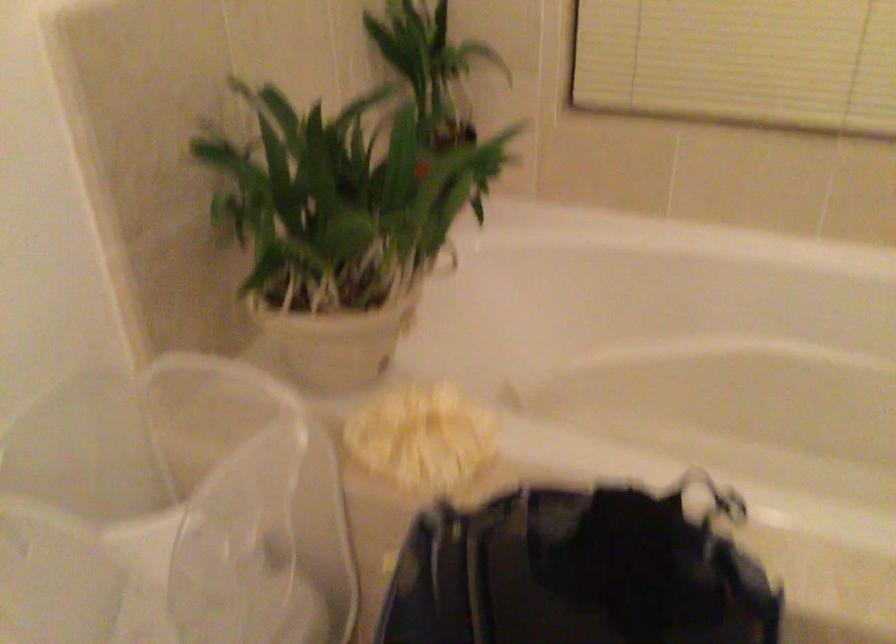
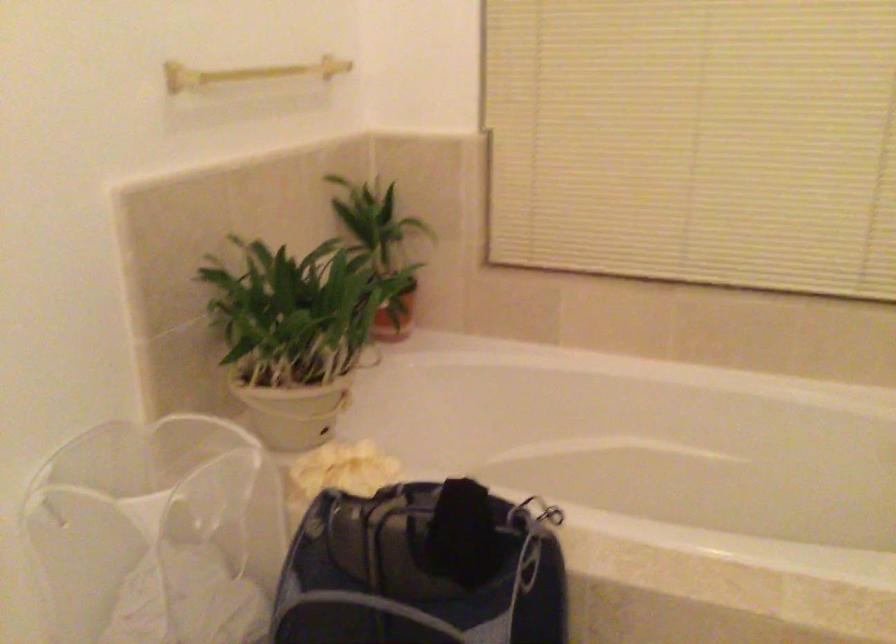
Question: In a continuous first-person perspective shot, in which direction is the camera moving?

Choices:
 (A) Left
 (B) Right
 (C) Forward
 (D) Backward

Answer: (D)